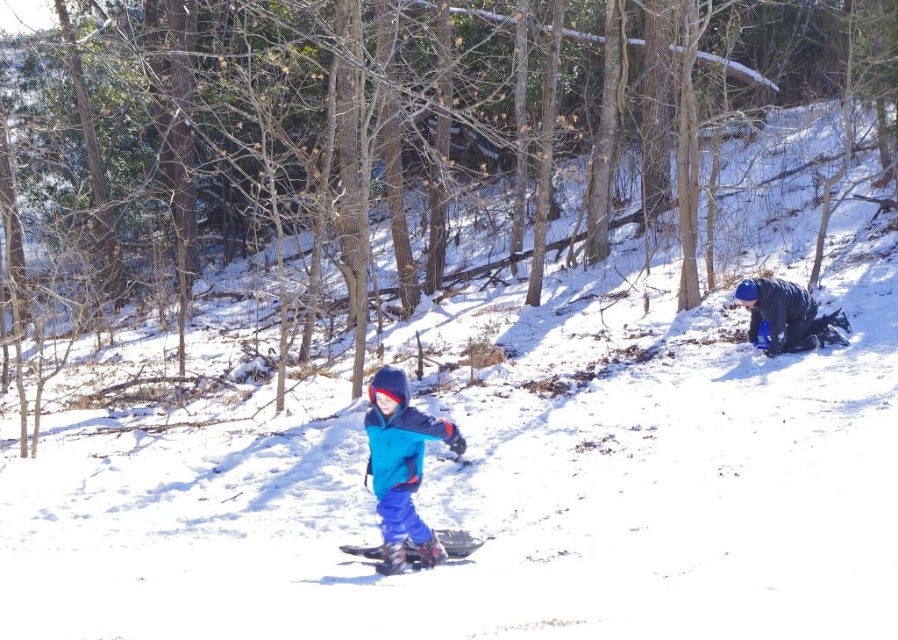
Is the position of blue fleece snowsuit at center less distant than that of white matte snowboard at center?

Yes, it is.

Between blue fleece snowsuit at center and white matte snowboard at center, which one appears on the right side from the viewer's perspective?

From the viewer's perspective, white matte snowboard at center appears more on the right side.

You are a GUI agent. You are given a task and a screenshot of the screen. Output one action in this format:
    pyautogui.click(x=<x>, y=<y>)
    Task: Click on the blue fleece snowsuit at center
    Image resolution: width=898 pixels, height=640 pixels.
    Given the screenshot: What is the action you would take?
    (x=401, y=467)

Is brown bark tree at center smaller than blue fabric snowshoe at center?

Actually, brown bark tree at center might be larger than blue fabric snowshoe at center.

Who is positioned more to the left, brown bark tree at center or blue fabric snowshoe at center?

Positioned to the left is blue fabric snowshoe at center.

Where is `brown bark tree at center`? The height and width of the screenshot is (640, 898). brown bark tree at center is located at coordinates (392, 156).

At what (x,y) coordinates should I click in order to perform the action: click on brown bark tree at center. Please return your answer as a coordinate pair (x, y). Looking at the image, I should click on (392, 156).

Describe the element at coordinates (418, 550) in the screenshot. The height and width of the screenshot is (640, 898). I see `white matte snowboard at center` at that location.

Can you confirm if white matte snowboard at center is positioned above blue fabric snowshoe at center?

No.

Between point (445, 531) and point (437, 548), which one is positioned behind?

The point (445, 531) is behind.

Identify the location of white matte snowboard at center. (418, 550).